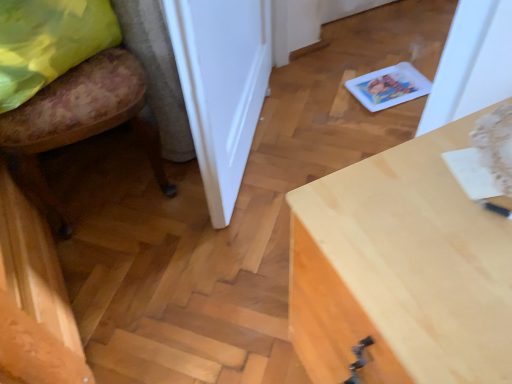
What are the coordinates of `vacant space underneath white glossy door at center (from a real-world perspective)` in the screenshot? It's located at pyautogui.click(x=256, y=140).